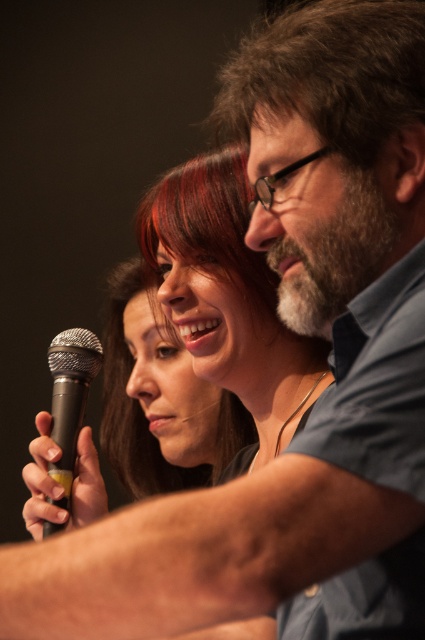
Is point (144, 344) positioned in front of point (53, 392)?

That is False.

The height and width of the screenshot is (640, 425). Describe the element at coordinates (163, 384) in the screenshot. I see `matte black microphone at center` at that location.

You are a GUI agent. You are given a task and a screenshot of the screen. Output one action in this format:
    pyautogui.click(x=<x>, y=<y>)
    Task: Click on the matte black microphone at center
    This screenshot has width=425, height=640.
    Given the screenshot: What is the action you would take?
    pyautogui.click(x=163, y=384)